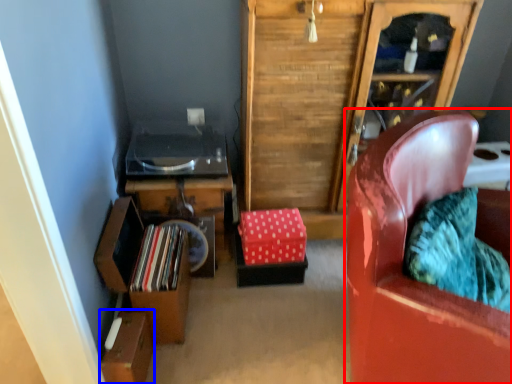
Question: Which object appears farthest to the camera in this image, chair (highlighted by a red box) or box (highlighted by a blue box)?

Choices:
 (A) chair
 (B) box

Answer: (B)